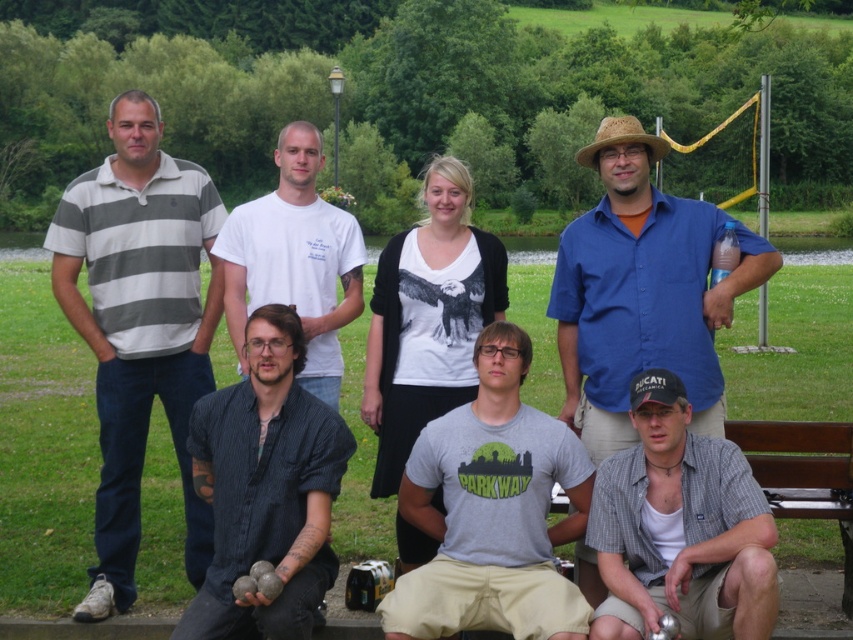
Question: Among these points, which one is farthest from the camera?

Choices:
 (A) (311, 259)
 (B) (289, 449)

Answer: (A)

Question: Is gray cotton t-shirt at center to the left of brown wooden bench at lower right from the viewer's perspective?

Choices:
 (A) no
 (B) yes

Answer: (B)

Question: Among these points, which one is nearest to the camera?

Choices:
 (A) (352, 451)
 (B) (616, 132)
 (C) (711, 436)

Answer: (C)

Question: Is blue cotton shirt at upper right smaller than brown wooden bench at lower right?

Choices:
 (A) no
 (B) yes

Answer: (A)

Question: Considering the real-world distances, which object is farthest from the striped cotton polo shirt at left?

Choices:
 (A) gray cotton t-shirt at center
 (B) gray checkered shirt at lower center
 (C) brown woven hat at upper center
 (D) white cotton t-shirt at center

Answer: (C)

Question: Is brown wooden bench at lower right closer to camera compared to brown woven hat at upper center?

Choices:
 (A) yes
 (B) no

Answer: (B)